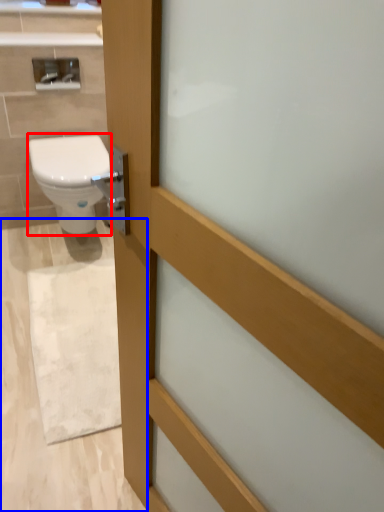
Question: Which object appears farthest to the camera in this image, bidet (highlighted by a red box) or plain (highlighted by a blue box)?

Choices:
 (A) bidet
 (B) plain

Answer: (A)